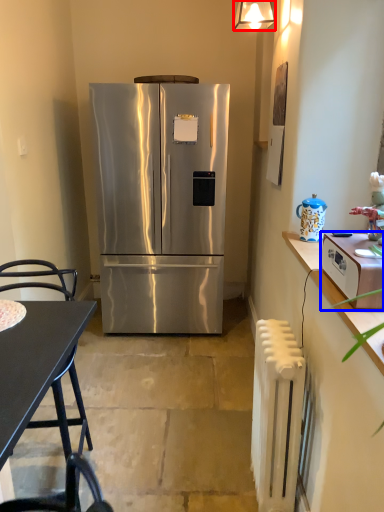
Question: Among these objects, which one is farthest to the camera, lamp (highlighted by a red box) or toaster (highlighted by a blue box)?

Choices:
 (A) lamp
 (B) toaster

Answer: (A)